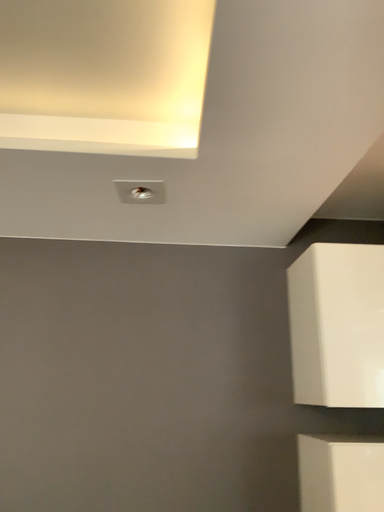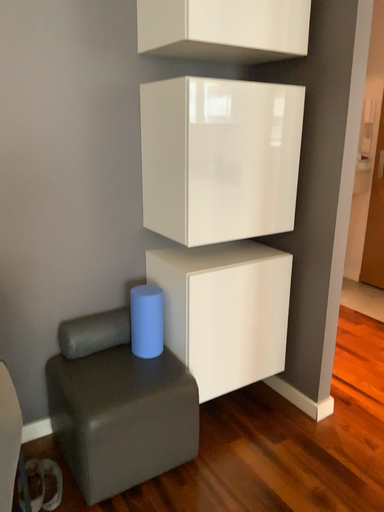
Question: Which way did the camera rotate in the video?

Choices:
 (A) rotated upward
 (B) rotated downward

Answer: (B)